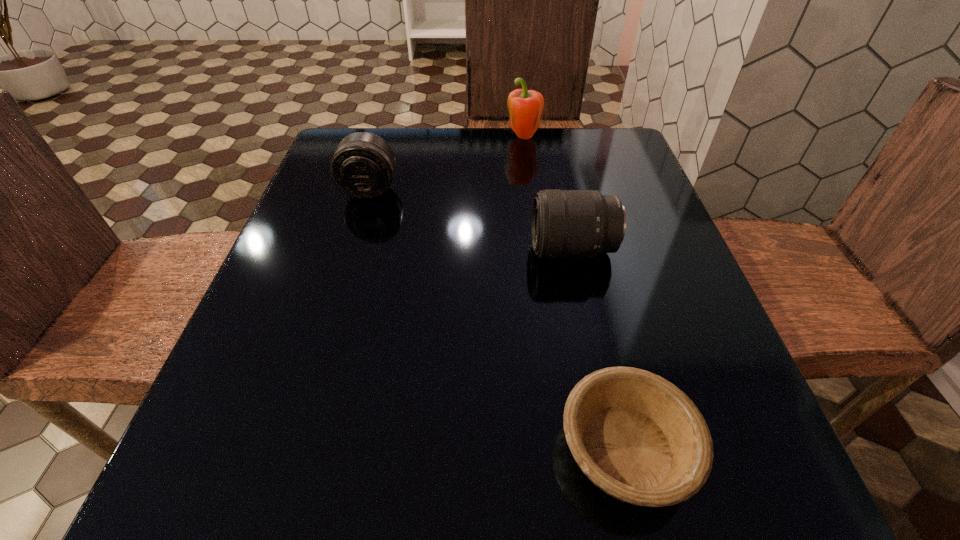
Identify the location of object located in the far left corner section of the desktop. (363, 165).

The image size is (960, 540). I want to click on object situated at the near right corner, so click(x=639, y=438).

Image resolution: width=960 pixels, height=540 pixels. In the image, there is a desktop. What are the coordinates of `vacant space at the far edge` in the screenshot? It's located at (456, 170).

In the image, there is a desktop. Where is `free space at the left edge`? The image size is (960, 540). free space at the left edge is located at coordinates (323, 279).

In the image, there is a desktop. At what (x,y) coordinates should I click in order to perform the action: click on vacant space at the right edge. Please return your answer as a coordinate pair (x, y). The image size is (960, 540). Looking at the image, I should click on (660, 283).

This screenshot has height=540, width=960. I want to click on vacant space at the far right corner of the desktop, so [582, 148].

The image size is (960, 540). Identify the location of vacant space at the near right corner of the desktop. (729, 508).

Image resolution: width=960 pixels, height=540 pixels. In order to click on free space between the nearer telephoto lens and the nearest object in this screenshot , I will do `click(599, 349)`.

Where is `free space between the second nearest object and the leftmost object`? This screenshot has height=540, width=960. free space between the second nearest object and the leftmost object is located at coordinates pyautogui.click(x=471, y=219).

This screenshot has width=960, height=540. I want to click on free space between the second farthest object and the second nearest object, so click(471, 219).